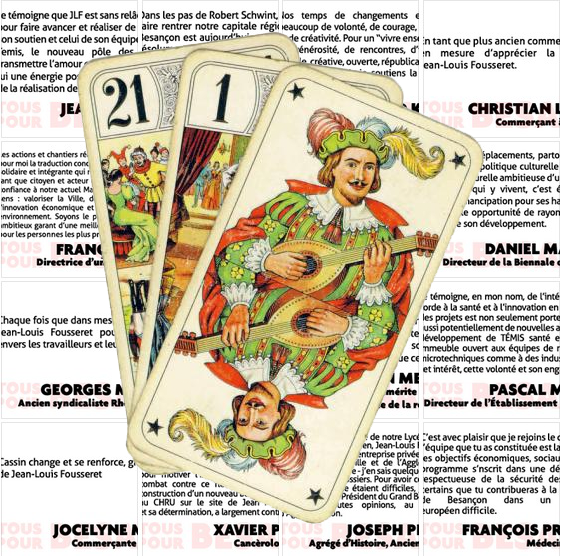
Where is `stair`? stair is located at coordinates (197, 210), (197, 221), (192, 250).